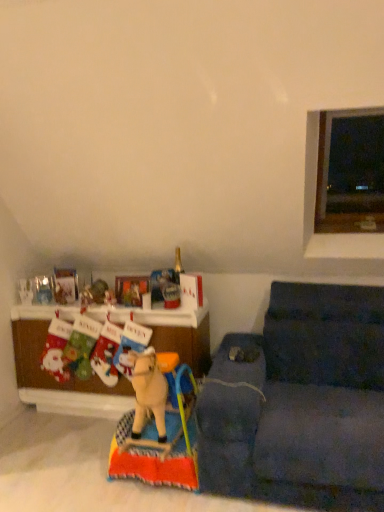
Question: Does transparent glass window at upper right come in front of dark blue fabric couch at lower right?

Choices:
 (A) yes
 (B) no

Answer: (B)

Question: Considering the relative sizes of transparent glass window at upper right and dark blue fabric couch at lower right in the image provided, is transparent glass window at upper right thinner than dark blue fabric couch at lower right?

Choices:
 (A) no
 (B) yes

Answer: (B)

Question: Would you say dark blue fabric couch at lower right is part of transparent glass window at upper right's contents?

Choices:
 (A) yes
 (B) no

Answer: (B)

Question: From the image's perspective, would you say transparent glass window at upper right is shown under dark blue fabric couch at lower right?

Choices:
 (A) yes
 (B) no

Answer: (B)

Question: From a real-world perspective, is transparent glass window at upper right below dark blue fabric couch at lower right?

Choices:
 (A) no
 (B) yes

Answer: (A)

Question: From a real-world perspective, is wooden cabinet at lower left above or below wooden horse at center, which is counted as the second toy, starting from the back?

Choices:
 (A) above
 (B) below

Answer: (B)

Question: Based on their sizes in the image, would you say wooden cabinet at lower left is bigger or smaller than wooden horse at center, the first toy in the right-to-left sequence?

Choices:
 (A) big
 (B) small

Answer: (A)

Question: Considering their positions, is wooden cabinet at lower left located in front of or behind wooden horse at center, which is the second toy from top to bottom?

Choices:
 (A) front
 (B) behind

Answer: (B)

Question: Visually, is wooden cabinet at lower left positioned to the left or to the right of wooden horse at center, the first toy in the right-to-left sequence?

Choices:
 (A) left
 (B) right

Answer: (A)

Question: Visually, is metallic reflective picture frame at center positioned to the left or to the right of wooden cabinet at lower left?

Choices:
 (A) right
 (B) left

Answer: (A)

Question: Considering the positions of point (119, 287) and point (51, 389), is point (119, 287) closer or farther from the camera than point (51, 389)?

Choices:
 (A) farther
 (B) closer

Answer: (B)

Question: Which is correct: metallic reflective picture frame at center is inside wooden cabinet at lower left, or outside of it?

Choices:
 (A) outside
 (B) inside

Answer: (A)

Question: From the image's perspective, is metallic reflective picture frame at center above or below wooden cabinet at lower left?

Choices:
 (A) below
 (B) above

Answer: (B)

Question: Visually, is metallic reflective picture frame at center positioned to the left or to the right of dark blue fabric couch at lower right?

Choices:
 (A) left
 (B) right

Answer: (A)

Question: In terms of width, does metallic reflective picture frame at center look wider or thinner when compared to dark blue fabric couch at lower right?

Choices:
 (A) wide
 (B) thin

Answer: (B)